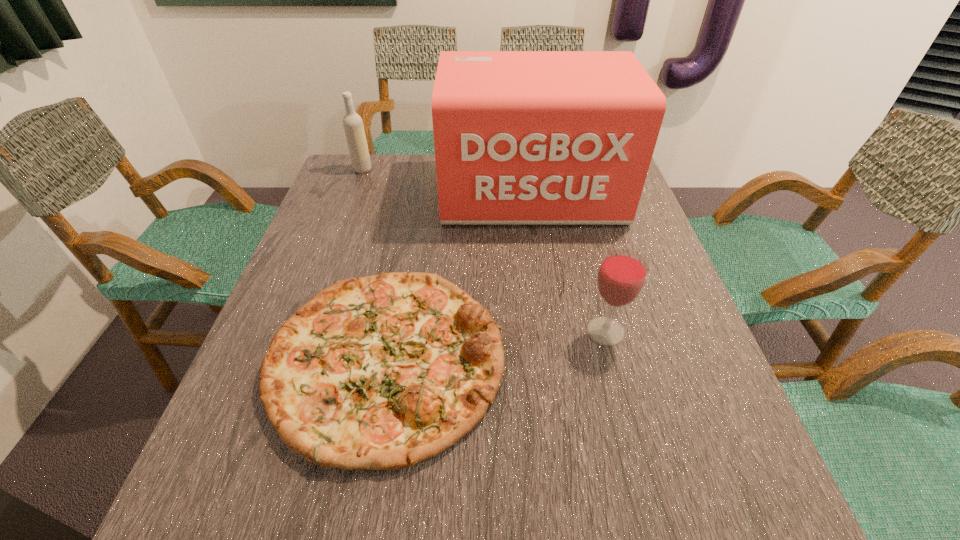
In order to click on object that can be found as the second closest to the pizza in this screenshot , I will do click(521, 137).

The width and height of the screenshot is (960, 540). What are the coordinates of `object that stands as the third closest to the wineglass` in the screenshot? It's located at (354, 130).

Locate an element on the screen. The height and width of the screenshot is (540, 960). vacant space that satisfies the following two spatial constraints: 1. on the front side of the vodka; 2. on the left side of the second shortest object is located at coordinates (303, 332).

At what (x,y) coordinates should I click in order to perform the action: click on free region that satisfies the following two spatial constraints: 1. on the surface of the second shortest object where the text is embossed; 2. on the right side of the tallest object. Please return your answer as a coordinate pair (x, y). Image resolution: width=960 pixels, height=540 pixels. Looking at the image, I should click on (552, 332).

Locate an element on the screen. vacant space that satisfies the following two spatial constraints: 1. on the surface of the box where the text is embossed; 2. on the right side of the wineglass is located at coordinates (552, 332).

Identify the location of free spot that satisfies the following two spatial constraints: 1. on the front side of the third shortest object; 2. on the left side of the second shortest object. (303, 332).